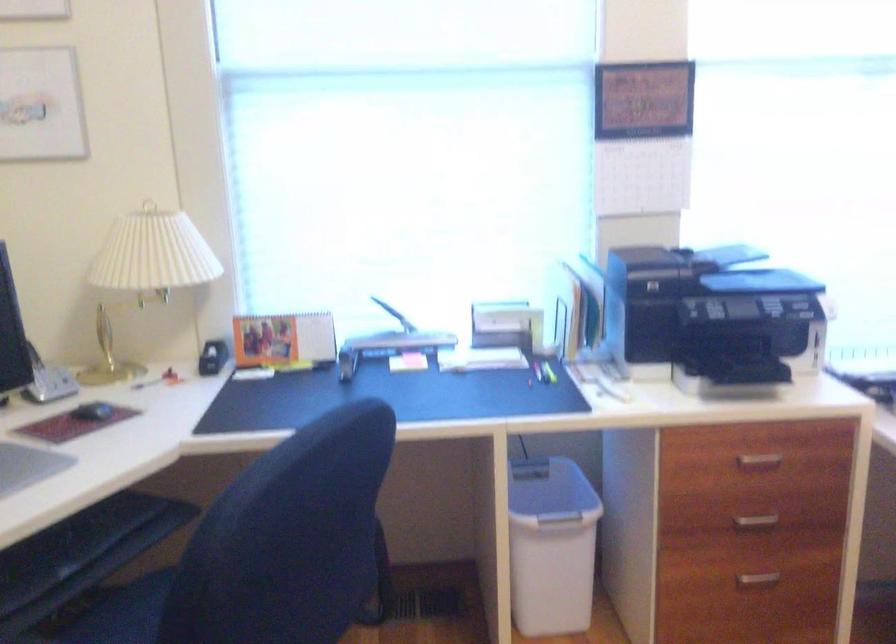
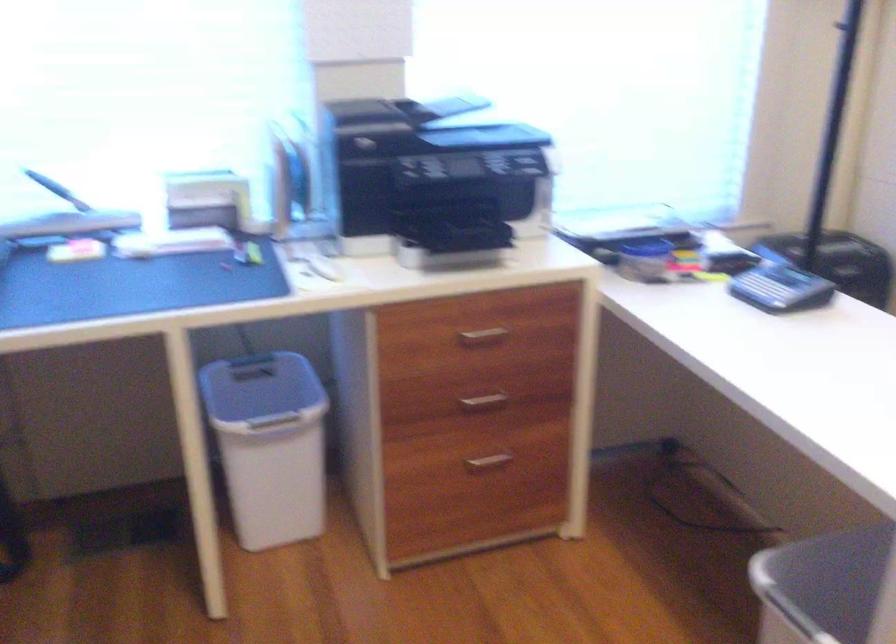
In a continuous first-person perspective shot, in which direction is the camera moving?

The movement direction of the cameraman is right, forward.